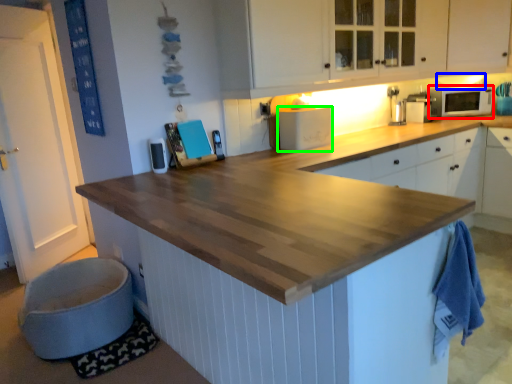
Question: Which object is positioned farthest from microwave oven (highlighted by a red box)? Select from exhaust hood (highlighted by a blue box) and appliance (highlighted by a green box).

Choices:
 (A) exhaust hood
 (B) appliance

Answer: (B)